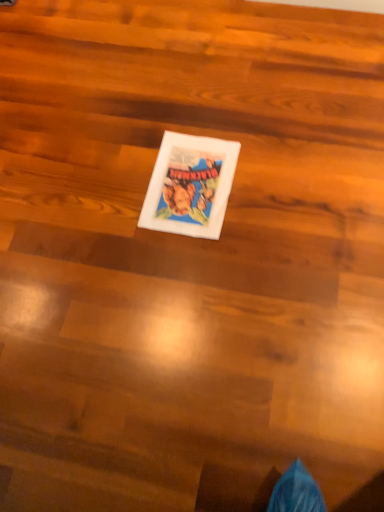
Where is `free space that is to the left of white matte comic book at center`? The width and height of the screenshot is (384, 512). free space that is to the left of white matte comic book at center is located at coordinates (101, 196).